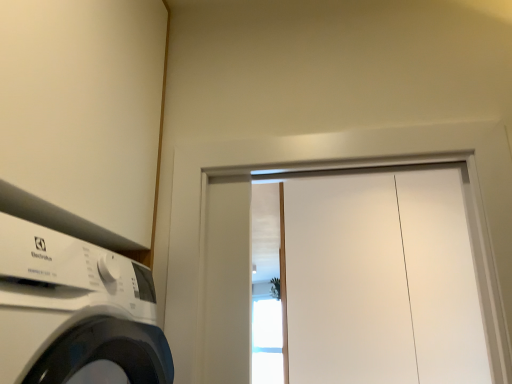
This screenshot has width=512, height=384. What do you see at coordinates (75, 312) in the screenshot? I see `white glossy washing machine at left` at bounding box center [75, 312].

This screenshot has height=384, width=512. What are the coordinates of `white glossy washing machine at left` in the screenshot? It's located at (75, 312).

I want to click on white glossy washing machine at left, so click(x=75, y=312).